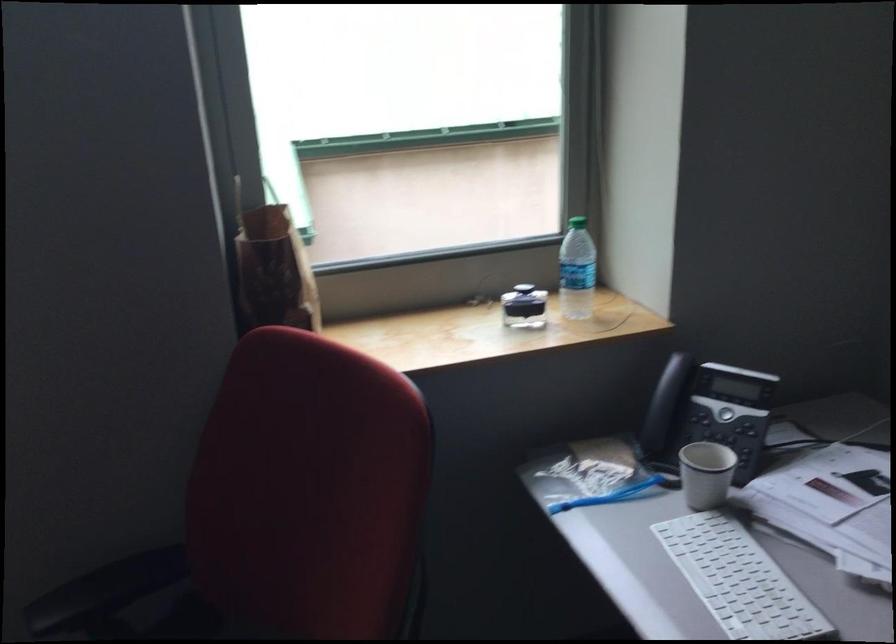
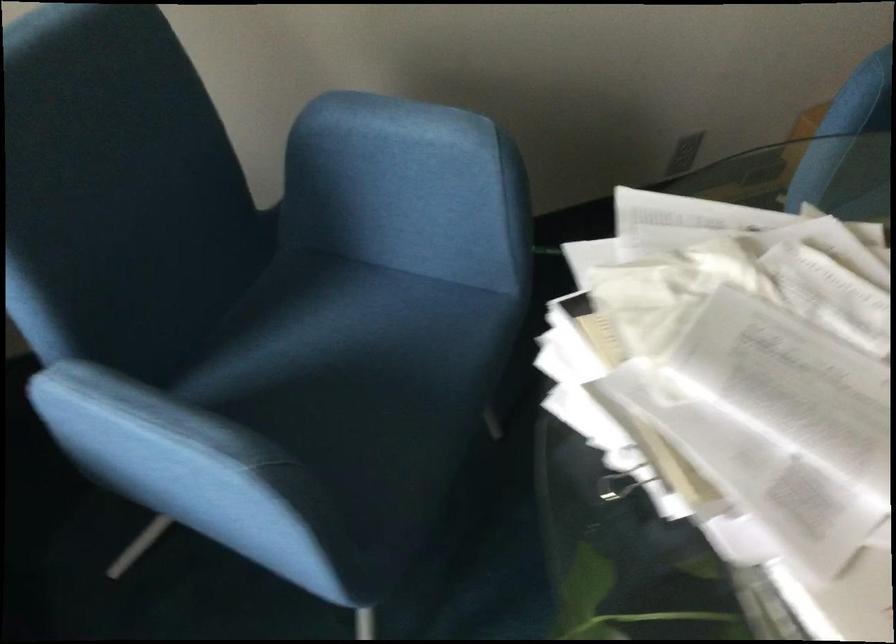
Based on the continuous images, in which direction is the camera rotating?

The camera rotated toward right-down.